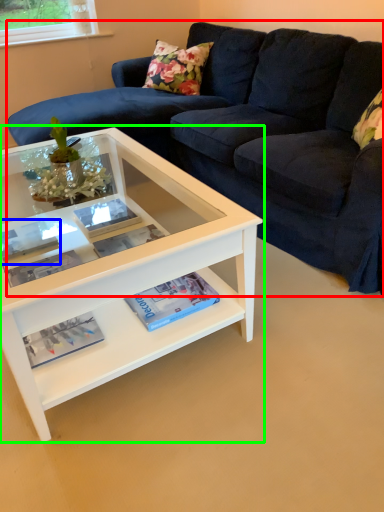
Question: Which is nearer to the studio couch (highlighted by a red box)? book (highlighted by a blue box) or coffee table (highlighted by a green box).

Choices:
 (A) book
 (B) coffee table

Answer: (B)